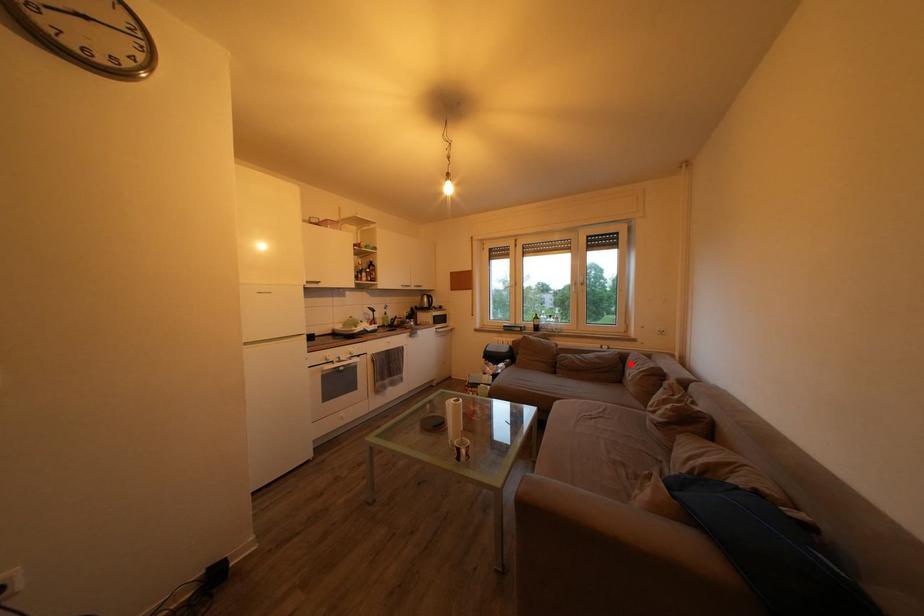
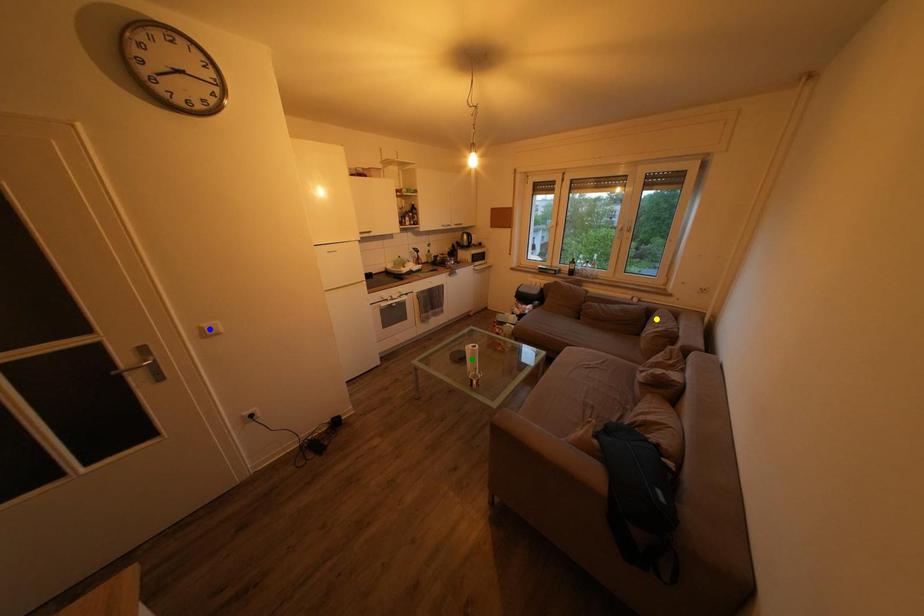
Question: I am providing you with two images of the same scene from different viewpoints. A red point is marked on the first image. You are given multiple points on the second image. Which spot in image 2 lines up with the point in image 1?

Choices:
 (A) blue point
 (B) yellow point
 (C) green point

Answer: (B)